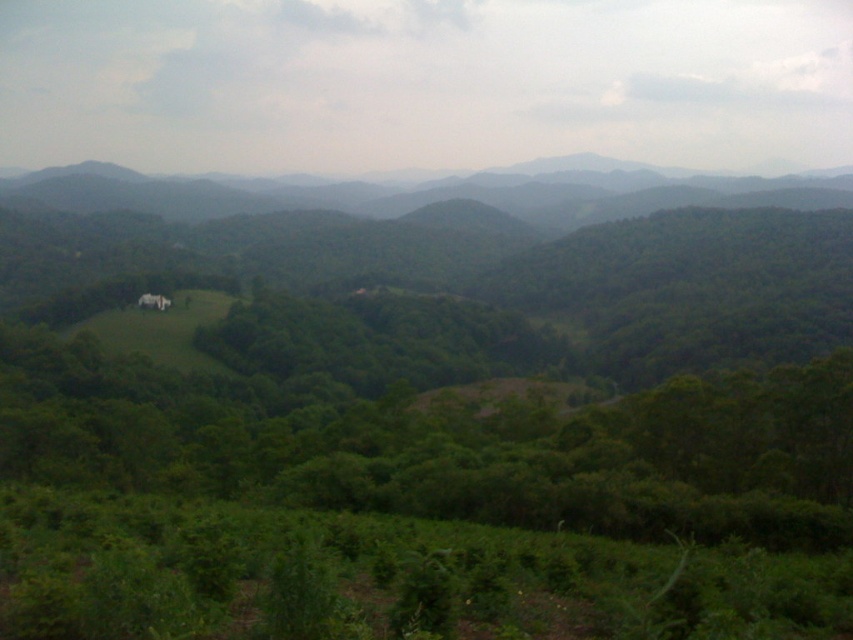
What do you see at coordinates (438, 444) in the screenshot? I see `green leafy tree at center` at bounding box center [438, 444].

Who is more forward, [676,529] or [115,177]?

Point [676,529]

Is point (189, 384) closer to camera compared to point (636, 179)?

Yes, it is in front of point (636, 179).

At what (x,y) coordinates should I click in order to perform the action: click on green leafy tree at center. Please return your answer as a coordinate pair (x, y). The width and height of the screenshot is (853, 640). Looking at the image, I should click on tap(438, 444).